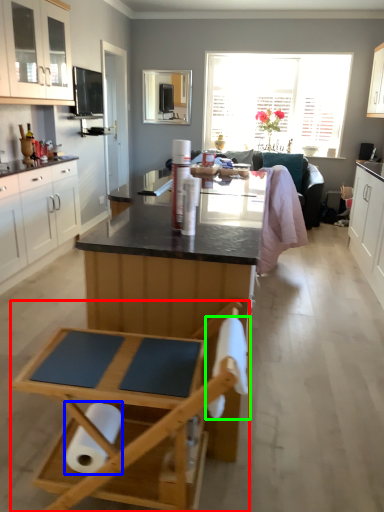
Question: Estimate the real-world distances between objects in this image. Which object is farther from folding chair (highlighted by a red box), toilet paper (highlighted by a blue box) or toilet paper (highlighted by a green box)?

Choices:
 (A) toilet paper
 (B) toilet paper

Answer: (B)